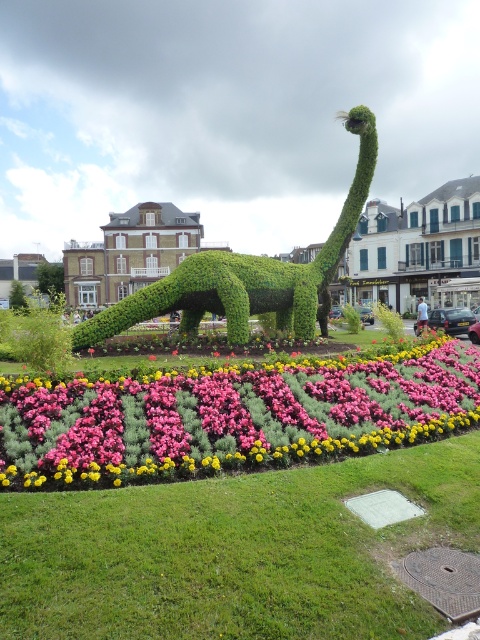
Question: Is the position of pink matte flowers at center more distant than that of green leafy plant at center?

Choices:
 (A) yes
 (B) no

Answer: (B)

Question: Is pink matte flowers at center behind green leafy plant at center?

Choices:
 (A) no
 (B) yes

Answer: (A)

Question: Where is pink matte flowers at center located in relation to green leafy plant at center in the image?

Choices:
 (A) below
 (B) above

Answer: (A)

Question: Which point is farther from the camera taking this photo?

Choices:
 (A) (151, 298)
 (B) (429, 422)

Answer: (A)